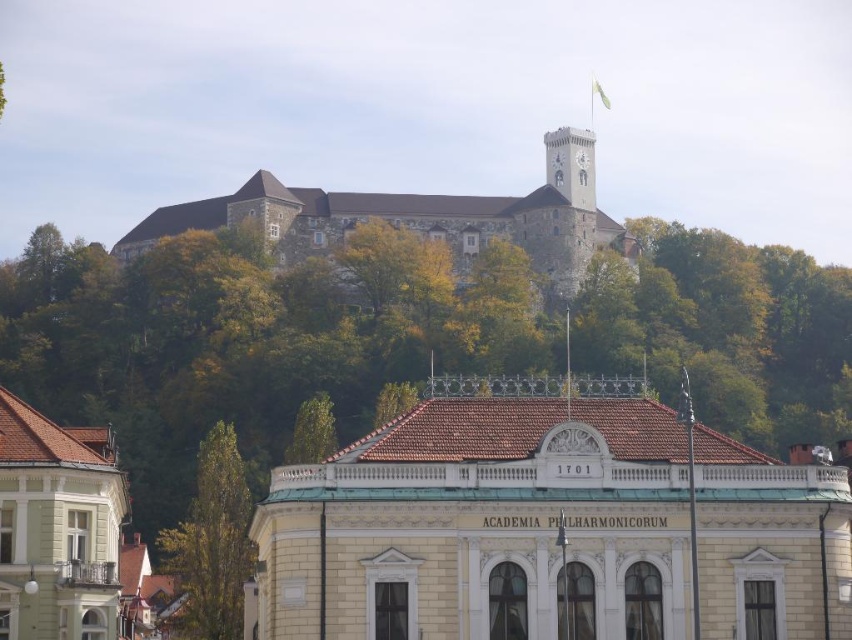
Question: Among these points, which one is farthest from the camera?

Choices:
 (A) (200, 538)
 (B) (550, 134)

Answer: (B)

Question: Which object appears closest to the camera in this image?

Choices:
 (A) brown stone castle at upper center
 (B) green leafy tree at upper center
 (C) green leafy tree at lower left

Answer: (C)

Question: Does light gray stone clock tower at upper center appear over green leafy tree at upper center?

Choices:
 (A) yes
 (B) no

Answer: (A)

Question: Which object appears farthest from the camera in this image?

Choices:
 (A) light gray stone clock tower at upper center
 (B) green leafy tree at lower left
 (C) brown stone castle at upper center
 (D) green leafy tree at upper center

Answer: (A)

Question: Does green leafy tree at lower left have a larger size compared to green leafy tree at upper center?

Choices:
 (A) yes
 (B) no

Answer: (A)

Question: Does brown stone castle at upper center appear on the right side of green leafy tree at lower left?

Choices:
 (A) no
 (B) yes

Answer: (B)